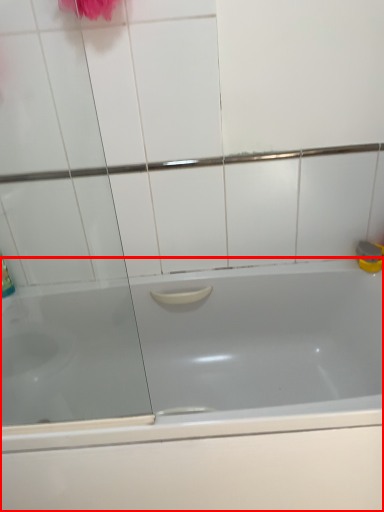
Question: Considering the relative positions of bathtub (annotated by the red box) and screen door in the image provided, where is bathtub (annotated by the red box) located with respect to the staircase?

Choices:
 (A) right
 (B) left

Answer: (A)